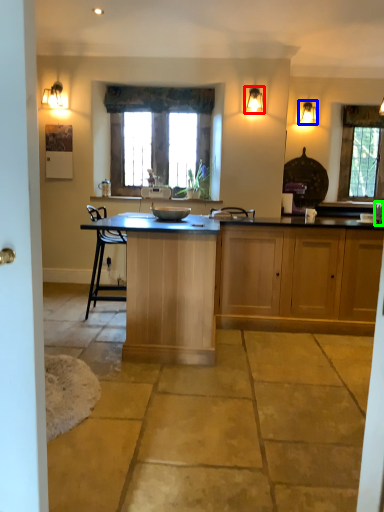
Question: Estimate the real-world distances between objects in this image. Which object is closer to light fixture (highlighted by a red box), light fixture (highlighted by a blue box) or faucet (highlighted by a green box)?

Choices:
 (A) light fixture
 (B) faucet

Answer: (A)